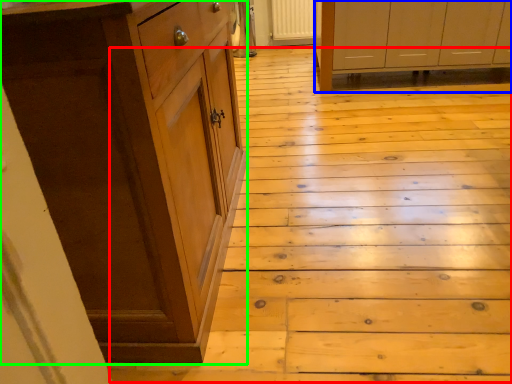
Question: Which object is positioned closest to stair (highlighted by a red box)? Select from cabinetry (highlighted by a blue box) and cabinetry (highlighted by a green box).

Choices:
 (A) cabinetry
 (B) cabinetry

Answer: (B)